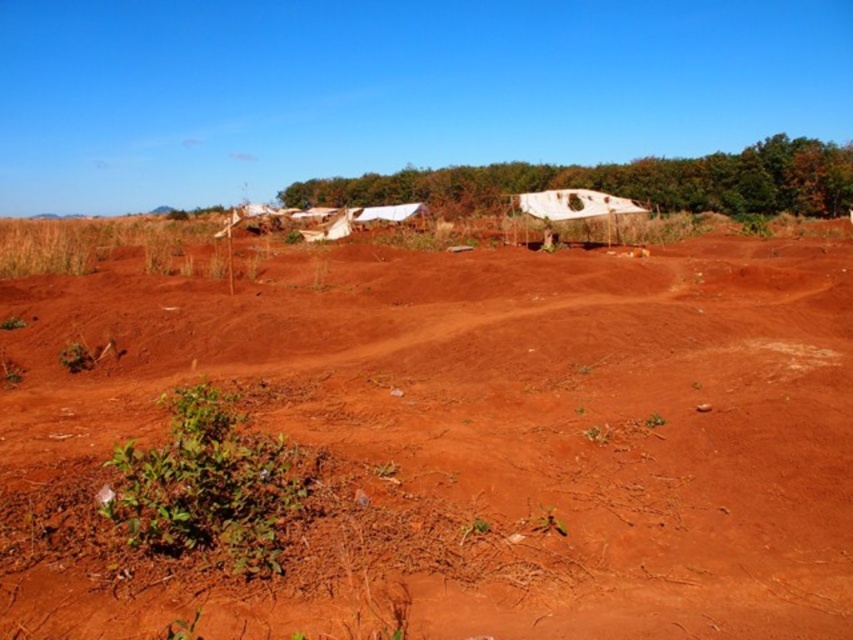
Question: Is dull reddish-brown soil at center below green leafy plant at lower left?

Choices:
 (A) no
 (B) yes

Answer: (A)

Question: Which of the following is the closest to the observer?

Choices:
 (A) green leafy trees at upper center
 (B) green leafy plant at lower left
 (C) dull reddish-brown soil at center

Answer: (C)

Question: Among these points, which one is nearest to the camera?

Choices:
 (A) (666, 323)
 (B) (218, 522)

Answer: (B)

Question: Which point appears closest to the camera in this image?

Choices:
 (A) (289, 481)
 (B) (830, 173)

Answer: (A)

Question: Is dull reddish-brown soil at center to the left of green leafy plant at lower left from the viewer's perspective?

Choices:
 (A) yes
 (B) no

Answer: (B)

Question: Does dull reddish-brown soil at center have a larger size compared to green leafy plant at lower left?

Choices:
 (A) no
 (B) yes

Answer: (B)